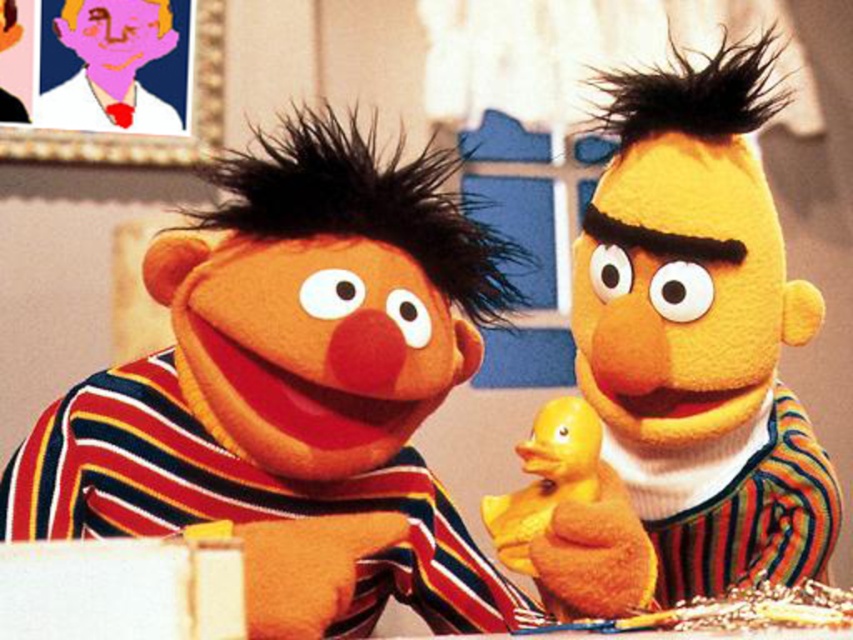
Question: Which point appears farthest from the camera in this image?

Choices:
 (A) (549, 586)
 (B) (276, 164)
 (C) (779, 340)

Answer: (B)

Question: Which object is positioned closest to the yellow plush duck at right?

Choices:
 (A) rubber duck at center
 (B) matte cardboard box at left

Answer: (A)

Question: Is matte cardboard box at left above yellow plush duck at right?

Choices:
 (A) no
 (B) yes

Answer: (A)

Question: Where is yellow plush duck at right located in relation to rubber duck at center in the image?

Choices:
 (A) above
 (B) below

Answer: (A)

Question: In this image, where is yellow plush duck at right located relative to rubber duck at center?

Choices:
 (A) above
 (B) below

Answer: (A)

Question: Which is farther from the rubber duck at center?

Choices:
 (A) yellow plush duck at right
 (B) matte cardboard box at left

Answer: (B)